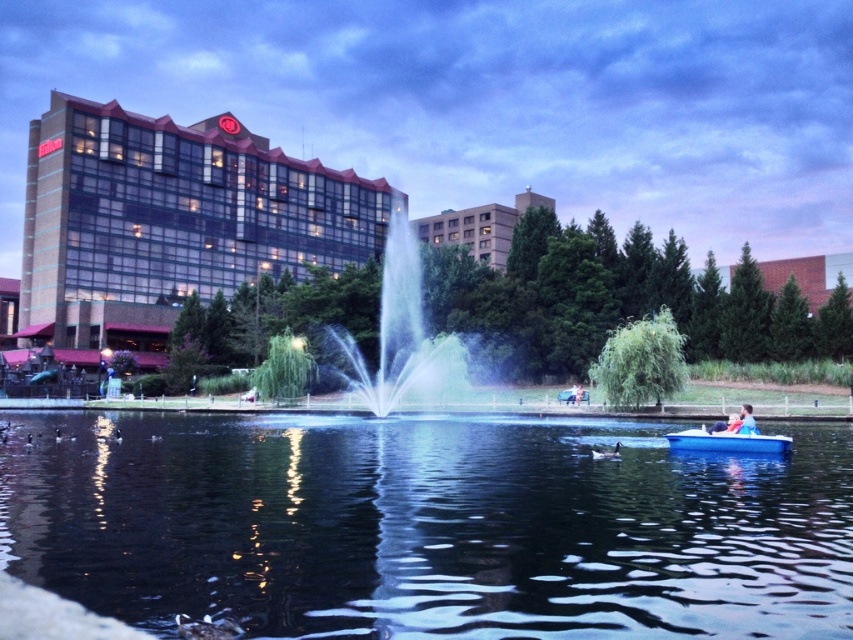
Which is more to the left, brick/concrete hotel at left or beige concrete building at center?

From the viewer's perspective, brick/concrete hotel at left appears more on the left side.

The image size is (853, 640). What do you see at coordinates (169, 221) in the screenshot?
I see `brick/concrete hotel at left` at bounding box center [169, 221].

Does point (115, 193) come behind point (514, 200)?

That is False.

Identify the location of brick/concrete hotel at left. Image resolution: width=853 pixels, height=640 pixels. point(169,221).

Is brick/concrete hotel at left positioned behind blue fabric person at center?

Yes, brick/concrete hotel at left is further from the viewer.

What do you see at coordinates (169, 221) in the screenshot?
I see `brick/concrete hotel at left` at bounding box center [169, 221].

I want to click on brick/concrete hotel at left, so click(169, 221).

Does brick/concrete hotel at left appear on the right side of blue translucent water at center?

In fact, brick/concrete hotel at left is to the left of blue translucent water at center.

You are a GUI agent. You are given a task and a screenshot of the screen. Output one action in this format:
    pyautogui.click(x=<x>, y=<y>)
    Task: Click on the brick/concrete hotel at left
    Image resolution: width=853 pixels, height=640 pixels.
    Given the screenshot: What is the action you would take?
    pyautogui.click(x=169, y=221)

Does point (61, 314) lie in front of point (422, 317)?

No.

Where is `brick/concrete hotel at left`? The width and height of the screenshot is (853, 640). brick/concrete hotel at left is located at coordinates (169, 221).